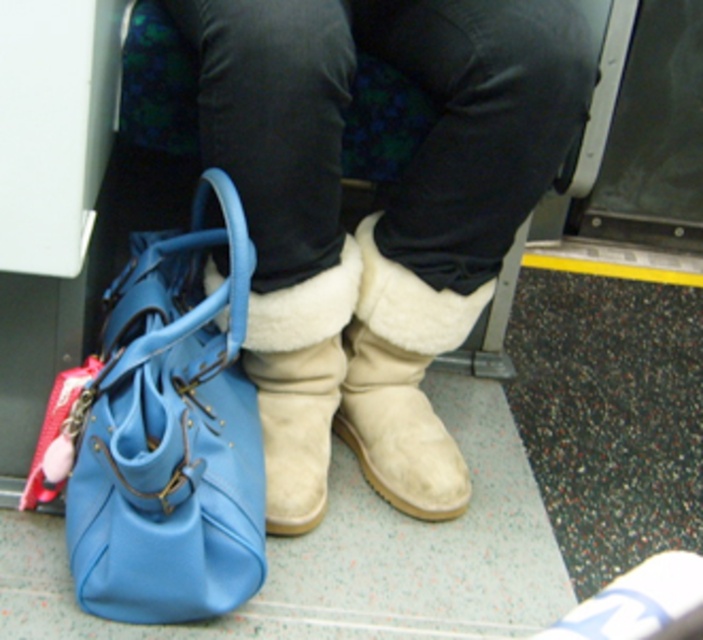
Question: Considering the relative positions of blue leather handbag at lower left and white suede boot at center in the image provided, where is blue leather handbag at lower left located with respect to white suede boot at center?

Choices:
 (A) below
 (B) above

Answer: (A)

Question: Which point is closer to the camera?

Choices:
 (A) blue leather handbag at lower left
 (B) suede boots at center

Answer: (A)

Question: Does suede boots at center have a smaller size compared to white suede boot at center?

Choices:
 (A) yes
 (B) no

Answer: (B)

Question: Estimate the real-world distances between objects in this image. Which object is closer to the blue leather handbag at lower left?

Choices:
 (A) white suede boot at center
 (B) suede boots at center

Answer: (B)

Question: Does suede boots at center lie behind blue leather handbag at lower left?

Choices:
 (A) no
 (B) yes

Answer: (B)

Question: Estimate the real-world distances between objects in this image. Which object is closer to the white suede boot at center?

Choices:
 (A) blue leather handbag at lower left
 (B) suede boots at center

Answer: (B)